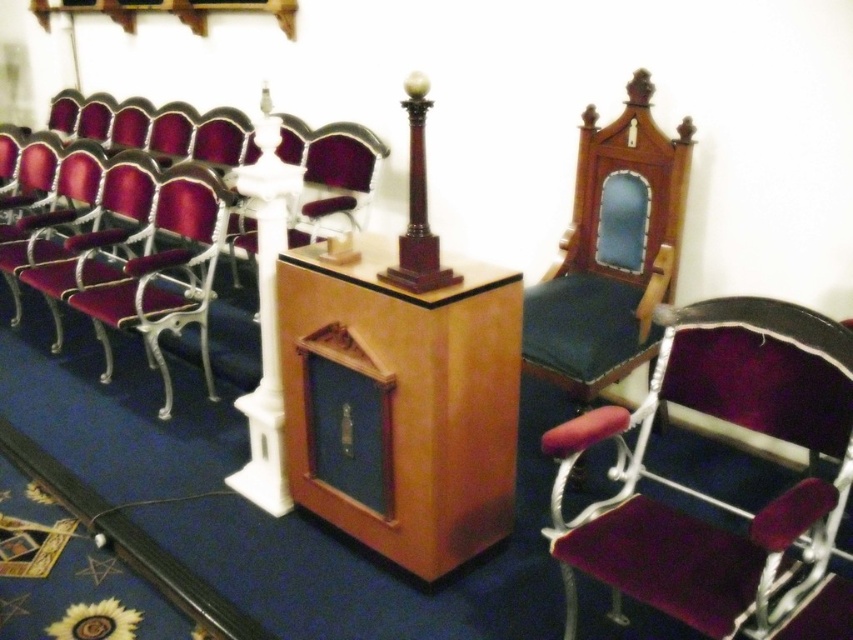
Between wooden podium at center and metallic silver armchair at left, which one has more height?

Standing taller between the two is metallic silver armchair at left.

Which is more to the right, wooden podium at center or metallic silver armchair at left?

wooden podium at center

Is point (425, 548) in front of point (207, 248)?

Yes.

At what (x,y) coordinates should I click in order to perform the action: click on wooden podium at center. Please return your answer as a coordinate pair (x, y). The width and height of the screenshot is (853, 640). Looking at the image, I should click on (399, 403).

Can you confirm if wooden podium at center is smaller than white glossy column at center?

Indeed, wooden podium at center has a smaller size compared to white glossy column at center.

In the scene shown: Between wooden podium at center and white glossy column at center, which one is positioned lower?

wooden podium at center is below.

Which is in front, point (509, 324) or point (273, 256)?

Positioned in front is point (509, 324).

This screenshot has height=640, width=853. Find the location of `wooden podium at center`. wooden podium at center is located at coordinates (399, 403).

Who is more forward, (766,516) or (618,262)?

Point (766,516) is more forward.

Who is more distant from viewer, (780, 536) or (627, 212)?

Positioned behind is point (627, 212).

The image size is (853, 640). Describe the element at coordinates (701, 518) in the screenshot. I see `velvet purple armchair at center` at that location.

Identify the location of velvet purple armchair at center. This screenshot has height=640, width=853. (701, 518).